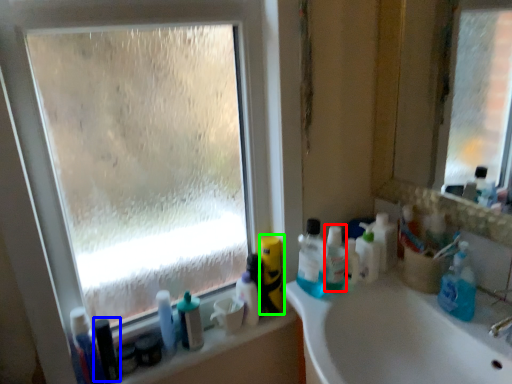
Question: Estimate the real-world distances between objects in this image. Which object is farther from toiletry (highlighted by a red box), toiletry (highlighted by a blue box) or cleaning product (highlighted by a green box)?

Choices:
 (A) toiletry
 (B) cleaning product

Answer: (A)